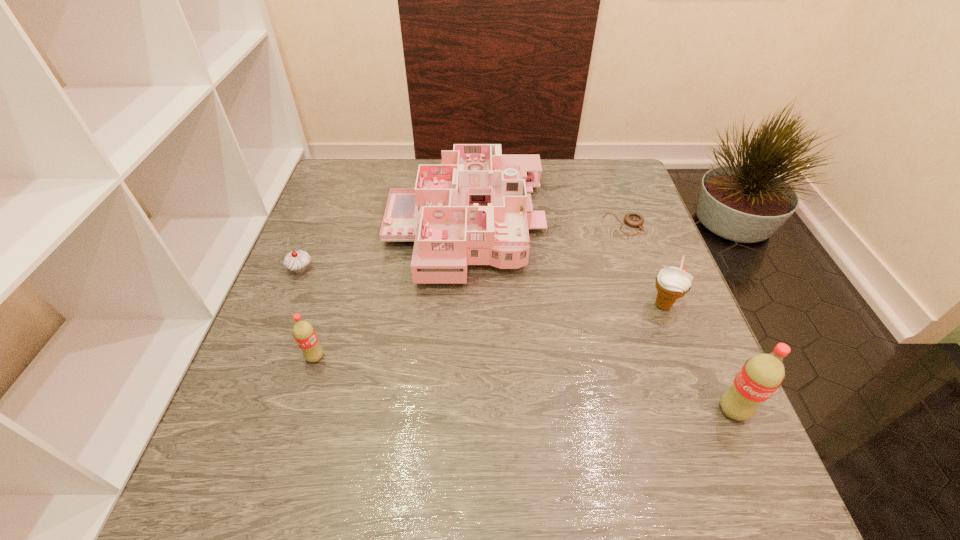
If equal spacing is the goal by inserting an additional pop_(soda) among them, please point out a vacant space for this new pop_(soda). Please provide its 2D coordinates. Your answer should be formatted as a tuple, i.e. [(x, y)], where the tuple contains the x and y coordinates of a point satisfying the conditions above.

[(515, 382)]